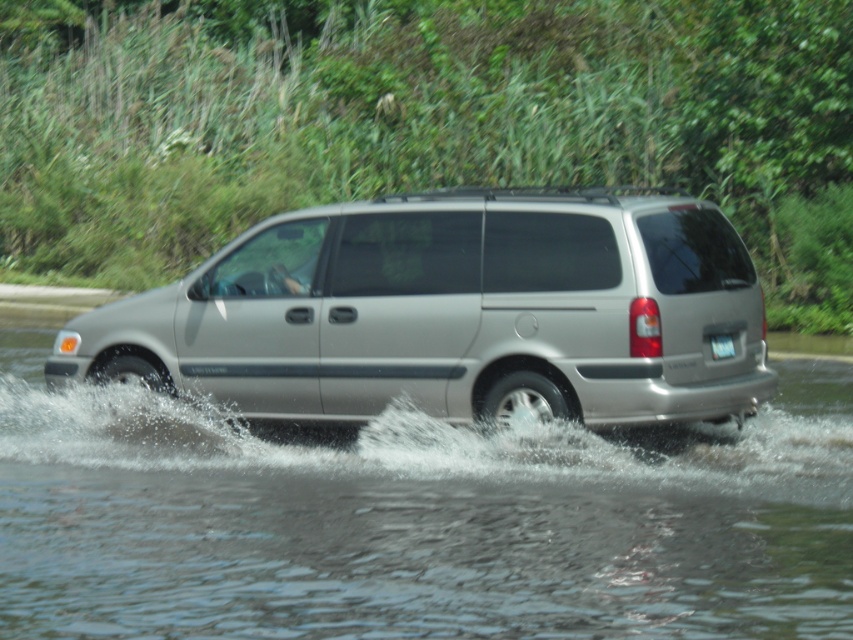
This screenshot has width=853, height=640. What are the coordinates of `clear water at lower center` in the screenshot? It's located at (418, 520).

Does clear water at lower center appear on the left side of satin silver van at center?

No, clear water at lower center is not to the left of satin silver van at center.

Where is `clear water at lower center`? Image resolution: width=853 pixels, height=640 pixels. clear water at lower center is located at coordinates (418, 520).

Find the location of `clear water at lower center`. clear water at lower center is located at coordinates (418, 520).

Measure the distance between clear water at lower center and camera.

The distance of clear water at lower center from camera is 20.82 feet.

Is clear water at lower center taller than white plastic license plate at rear?

Yes.

What do you see at coordinates (418, 520) in the screenshot? Image resolution: width=853 pixels, height=640 pixels. I see `clear water at lower center` at bounding box center [418, 520].

Where is `clear water at lower center`? The height and width of the screenshot is (640, 853). clear water at lower center is located at coordinates (418, 520).

Describe the element at coordinates (453, 312) in the screenshot. This screenshot has width=853, height=640. I see `satin silver van at center` at that location.

Who is taller, satin silver van at center or white plastic license plate at rear?

satin silver van at center

Image resolution: width=853 pixels, height=640 pixels. What do you see at coordinates (453, 312) in the screenshot?
I see `satin silver van at center` at bounding box center [453, 312].

You are a GUI agent. You are given a task and a screenshot of the screen. Output one action in this format:
    pyautogui.click(x=<x>, y=<y>)
    Task: Click on the satin silver van at center
    The image size is (853, 640).
    Given the screenshot: What is the action you would take?
    pyautogui.click(x=453, y=312)